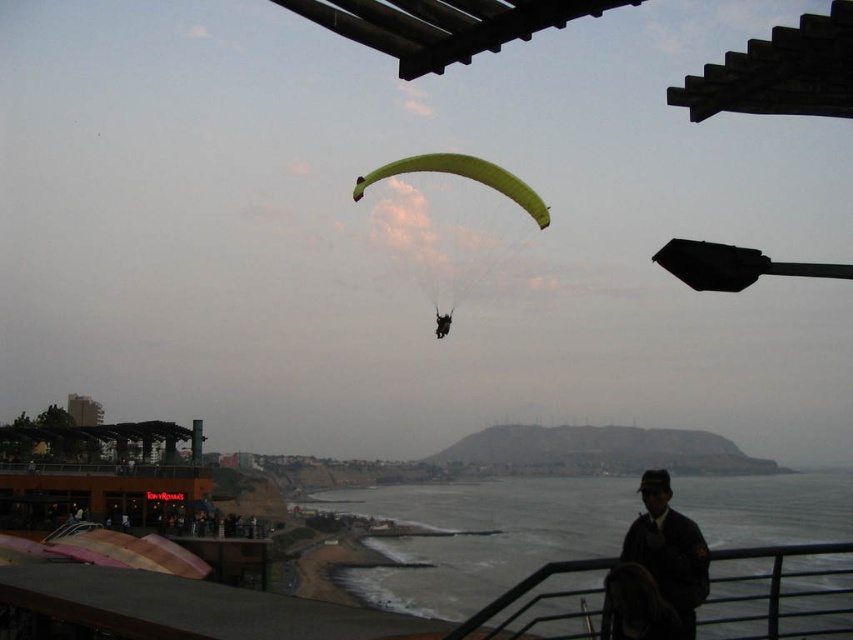
You are a tourist standing on the wooden structure with a slatted roof. You see the clear water at lower center and the green fabric parachute at center. Which object is closer to you?

The green fabric parachute at center is closer to you because it is above the clear water at lower center.

You are standing on the wooden structure with a slatted roof and want to retrieve the dark brown leather jacket at lower right. However, there is clear water at lower center in your path. Can you reach the jacket without getting wet?

The dark brown leather jacket at lower right is behind the clear water at lower center, so you can walk around the clear water at lower center to reach the jacket without getting wet.